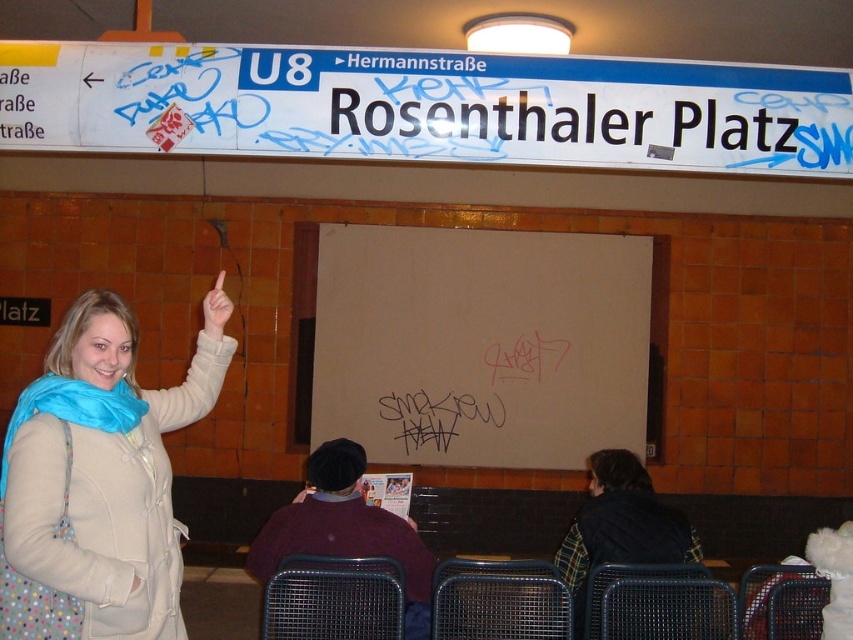
Question: Considering the relative positions of white plastic sign at upper center and white matte finger at upper center in the image provided, where is white plastic sign at upper center located with respect to white matte finger at upper center?

Choices:
 (A) below
 (B) above

Answer: (B)

Question: From the image, what is the correct spatial relationship of white plastic sign at upper center in relation to white matte finger at upper center?

Choices:
 (A) left
 (B) right

Answer: (B)

Question: Is white plastic sign at upper center below white matte board at center?

Choices:
 (A) no
 (B) yes

Answer: (A)

Question: Estimate the real-world distances between objects in this image. Which object is closer to the white plastic sign at upper center?

Choices:
 (A) white matte board at center
 (B) beige fabric coat at upper left
 (C) black marker graffiti at center
 (D) white matte finger at upper center

Answer: (D)

Question: Which point appears farthest from the camera in this image?

Choices:
 (A) (210, 301)
 (B) (456, 397)
 (C) (206, 394)

Answer: (B)

Question: Among these points, which one is farthest from the camera?

Choices:
 (A) (392, 394)
 (B) (171, 131)
 (C) (212, 336)

Answer: (A)